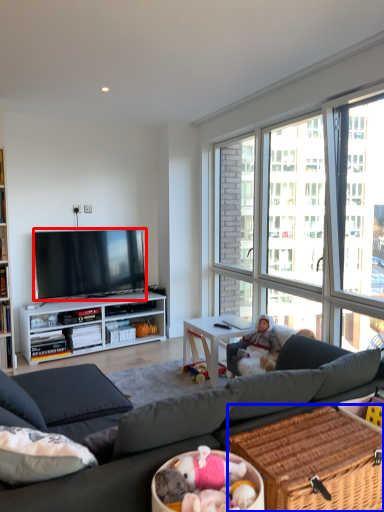
Question: Which point is further to the camera, television (highlighted by a red box) or picnic basket (highlighted by a blue box)?

Choices:
 (A) television
 (B) picnic basket

Answer: (A)